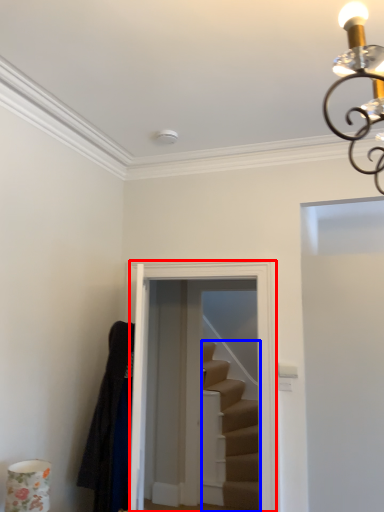
Question: Which object appears closest to the camera in this image, glass door (highlighted by a red box) or stairs (highlighted by a blue box)?

Choices:
 (A) glass door
 (B) stairs

Answer: (A)